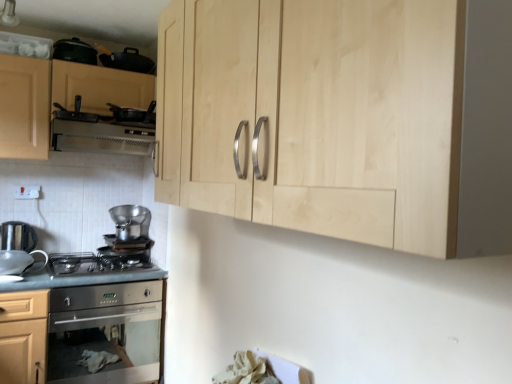
Question: Looking at their shapes, would you say white plastic exhaust hood at upper left is wider or thinner than satin silver pot at center, the 2th appliance positioned from the bottom?

Choices:
 (A) thin
 (B) wide

Answer: (B)

Question: From a real-world perspective, is white plastic exhaust hood at upper left physically located above or below satin silver pot at center, the 2th appliance positioned from the bottom?

Choices:
 (A) above
 (B) below

Answer: (A)

Question: Based on their relative distances, which object is nearer to the matte wood cabinet at upper left, which is counted as the 2th cabinetry, starting from the front?

Choices:
 (A) natural wood cabinet at upper center, which appears as the 1th cabinetry when viewed from the front
 (B) metallic silver pan at upper left, which is the 3th appliance in top-to-bottom order
 (C) satin silver gas stove at lower left
 (D) black matte frying pan at upper left, the 4th appliance when ordered from bottom to top
 (E) satin silver pot at center, the 2th appliance positioned from the bottom

Answer: (B)

Question: Based on their relative distances, which object is nearer to the natural wood cabinet at upper center, which appears as the 1th cabinetry when viewed from the front?

Choices:
 (A) white plastic exhaust hood at upper left
 (B) stainless steel countertop at lower left
 (C) matte wood cabinet at upper left, the second cabinetry when ordered from right to left
 (D) satin silver kettle at lower left, the first appliance in the bottom-to-top sequence
 (E) metallic silver pan at upper left, the 3th appliance when ordered from bottom to top

Answer: (B)